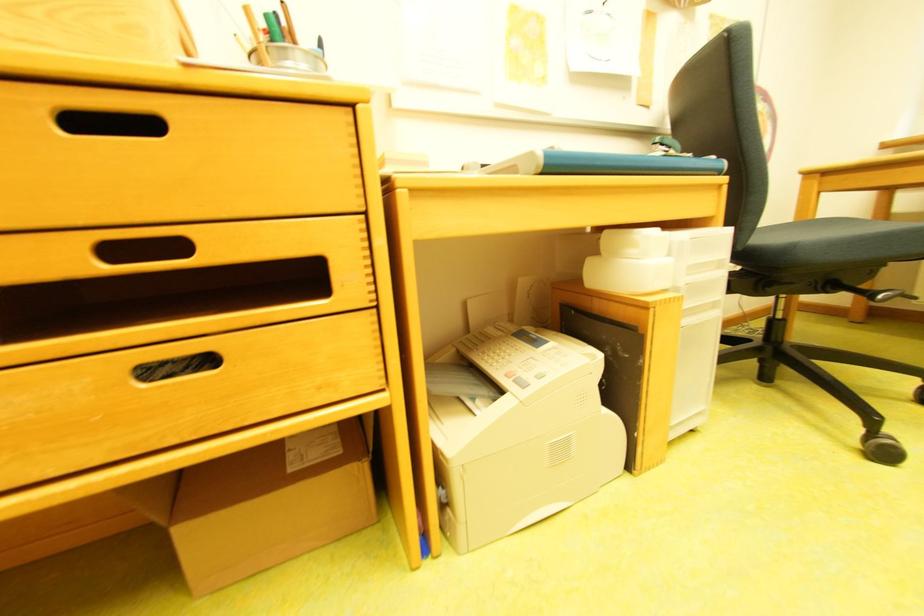
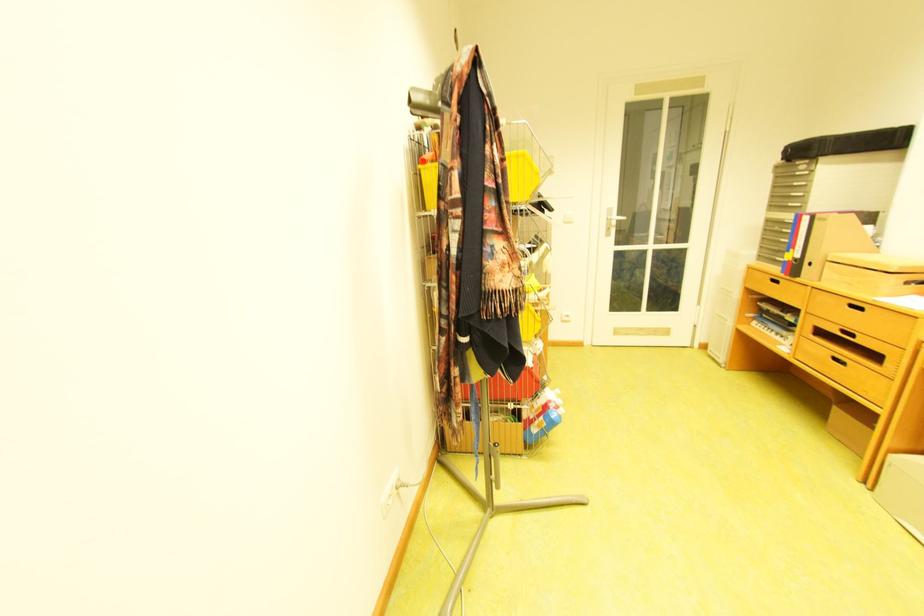
The point at [162,374] is marked in the first image. Where is the corresponding point in the second image?

(845, 360)